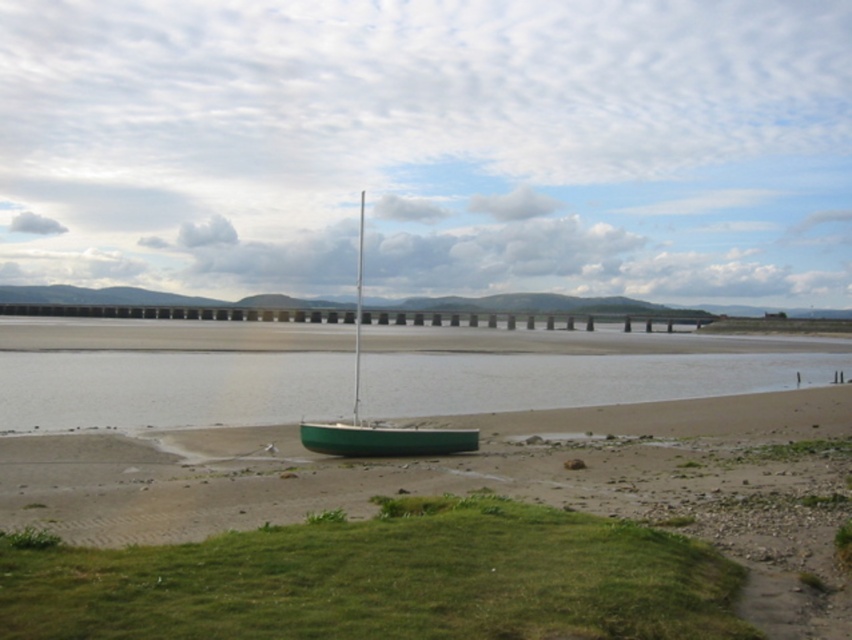
Question: Is green matte sailboat at center behind green matte canoe at center?

Choices:
 (A) no
 (B) yes

Answer: (A)

Question: Which point is farther from the camera taking this photo?

Choices:
 (A) (394, 445)
 (B) (387, 432)

Answer: (B)

Question: Can you confirm if green matte sailboat at center is positioned above green matte canoe at center?

Choices:
 (A) yes
 (B) no

Answer: (A)

Question: Where is green matte sailboat at center located in relation to green matte canoe at center in the image?

Choices:
 (A) right
 (B) left

Answer: (B)

Question: Which object is farther from the camera taking this photo?

Choices:
 (A) green matte sailboat at center
 (B) green matte canoe at center

Answer: (B)